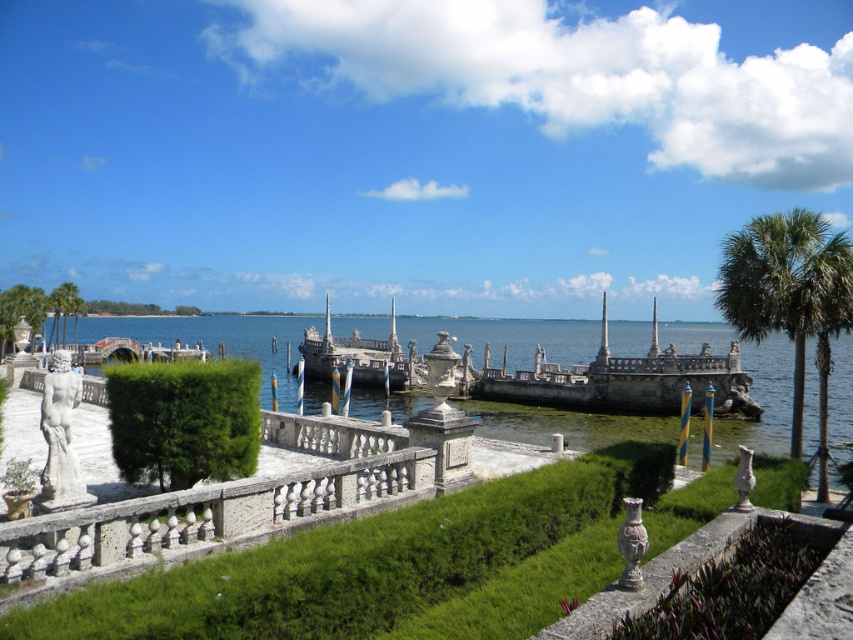
You are planning to install a new decorative fountain in the garden. The fountain requires a space that is larger than the green stone hedge at center. Based on the scene description, can the clear blue water at center accommodate the fountain?

The clear blue water at center has a larger size compared to the green stone hedge at center, so yes, the fountain can be placed there as it has sufficient space.

From the picture: You are standing at the edge of the garden near the stone balustrade and want to place a new decorative urn. The garden has a green stone hedge at center. Where should you place the new urn to ensure it aligns with the existing decorative elements along the balustrade?

The green stone hedge at center is located at point (734, 586), so you should place the new urn near this coordinate to align with the existing decorative elements along the balustrade.

You are standing at the edge of the garden and want to take a photo of both the clear blue water at center and the green stone hedge at center. Which one of these two objects will appear larger in your camera viewfinder?

The clear blue water at center will appear larger in the camera viewfinder because it is much taller than the green stone hedge at center.